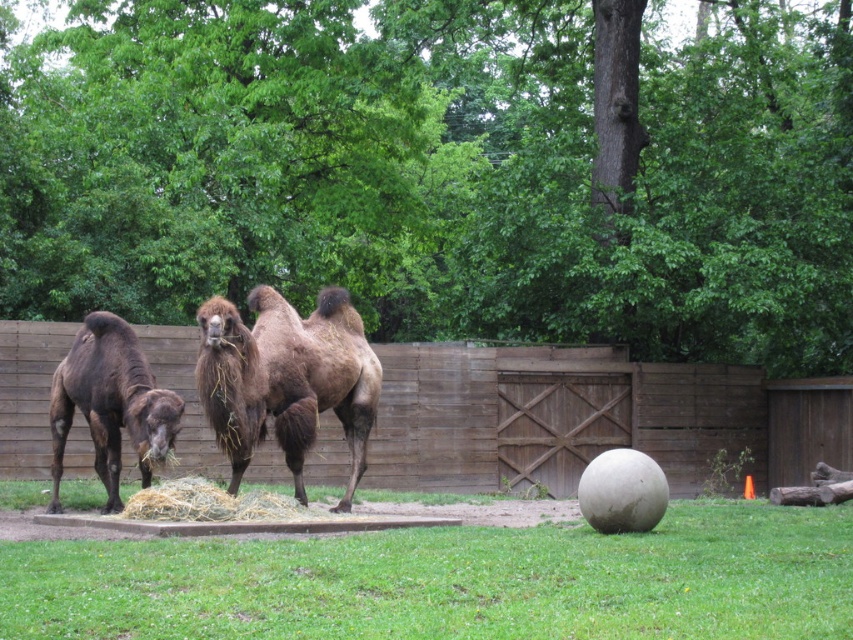
Between green grass at lower center and brown fuzzy camel at center, which one has more height?

brown fuzzy camel at center is taller.

Measure the distance between point (784, 611) and camera.

Point (784, 611) and camera are 7.07 meters apart.

What do you see at coordinates (453, 580) in the screenshot? I see `green grass at lower center` at bounding box center [453, 580].

Identify the location of green grass at lower center. (453, 580).

Can you confirm if brown wooden fence at center is positioned below brown fuzzy camel at center?

Indeed, brown wooden fence at center is positioned under brown fuzzy camel at center.

Is brown wooden fence at center positioned behind brown fuzzy camel at center?

Yes.

At what (x,y) coordinates should I click in order to perform the action: click on brown wooden fence at center. Please return your answer as a coordinate pair (x, y). The image size is (853, 640). Looking at the image, I should click on (590, 417).

This screenshot has height=640, width=853. I want to click on brown wooden fence at center, so click(590, 417).

Is point (358, 560) positioned after point (195, 428)?

No, it is not.

Which is more to the left, green grass at lower center or brown wooden fence at center?

green grass at lower center is more to the left.

Is point (20, 550) farther from viewer compared to point (766, 435)?

No, it is not.

In order to click on green grass at lower center in this screenshot , I will do `click(453, 580)`.